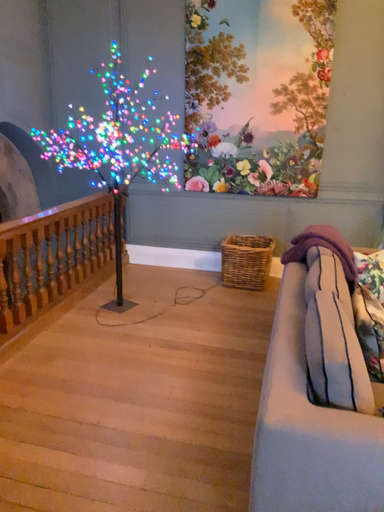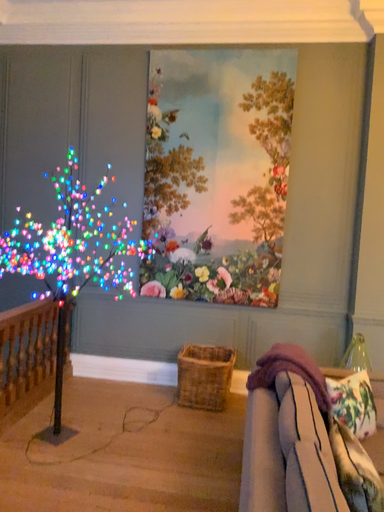
Question: How did the camera likely rotate when shooting the video?

Choices:
 (A) rotated downward
 (B) rotated upward

Answer: (B)